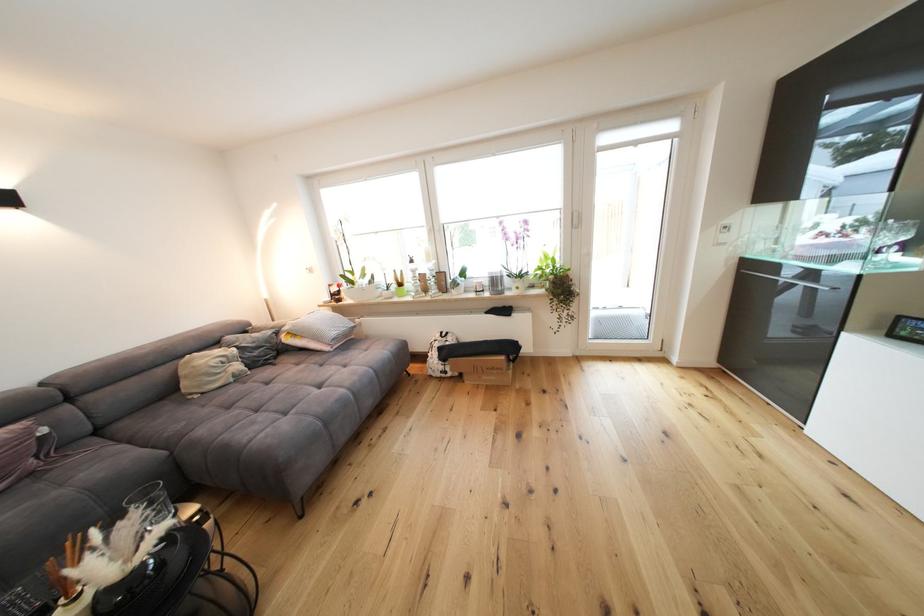
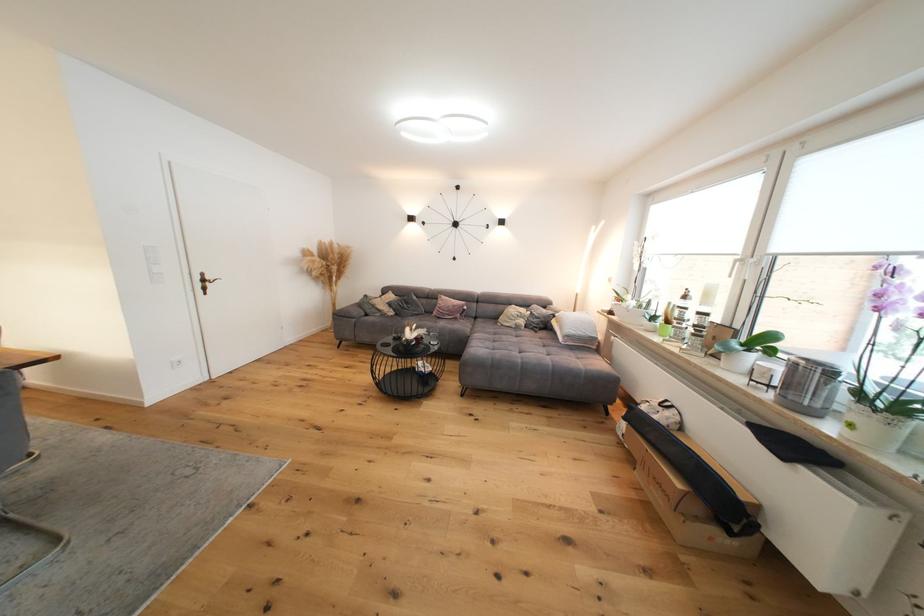
The point at (246,379) is marked in the first image. Where is the corresponding point in the second image?

(524, 330)